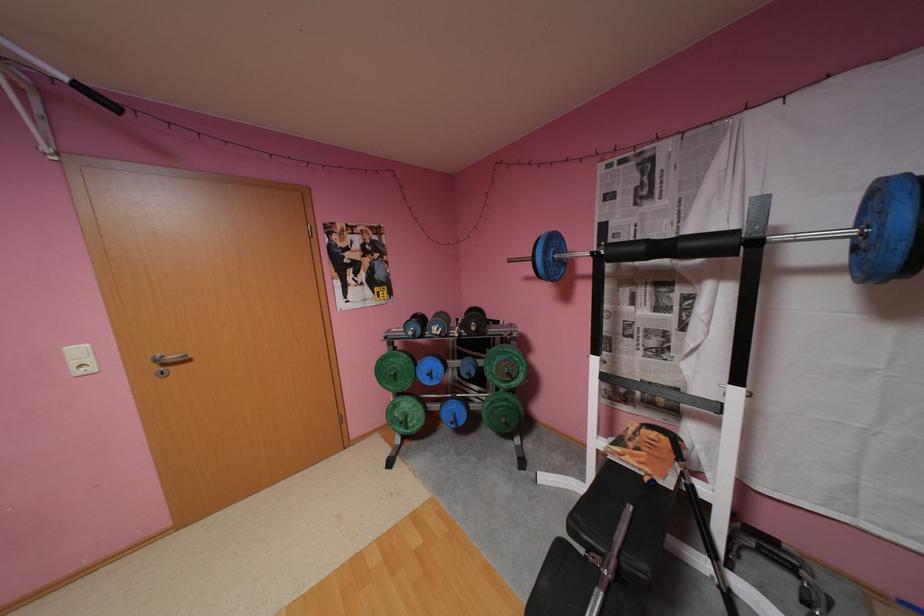
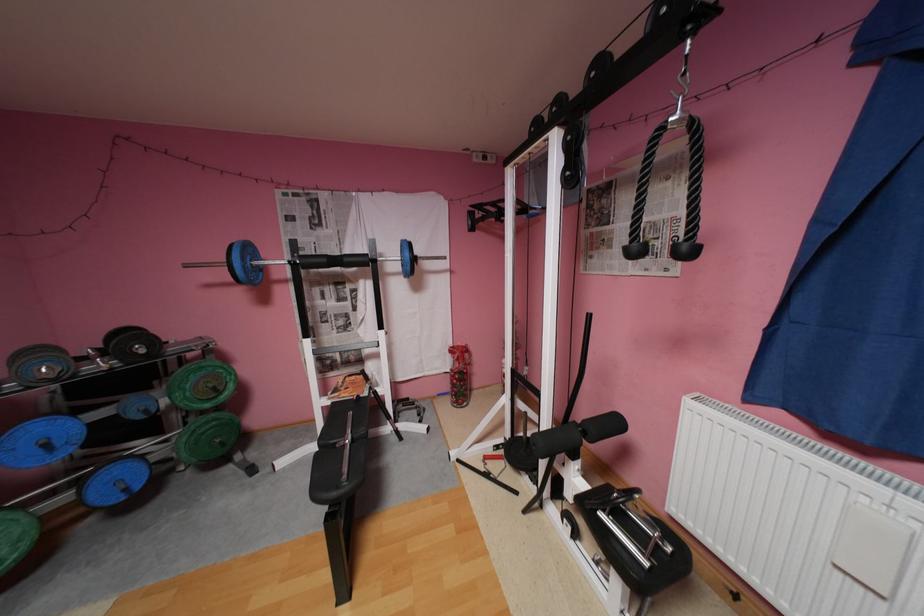
Where in the second image is the point corresponding to the point at 691,245 from the first image?

(355, 259)